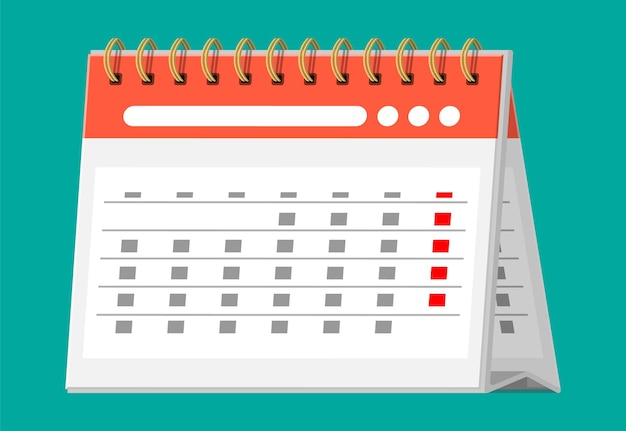
Locate an element on the screen. Image resolution: width=626 pixels, height=431 pixels. boxes on the top row is located at coordinates (130, 194), (181, 193), (233, 193), (287, 194), (341, 193), (390, 194), (442, 194).